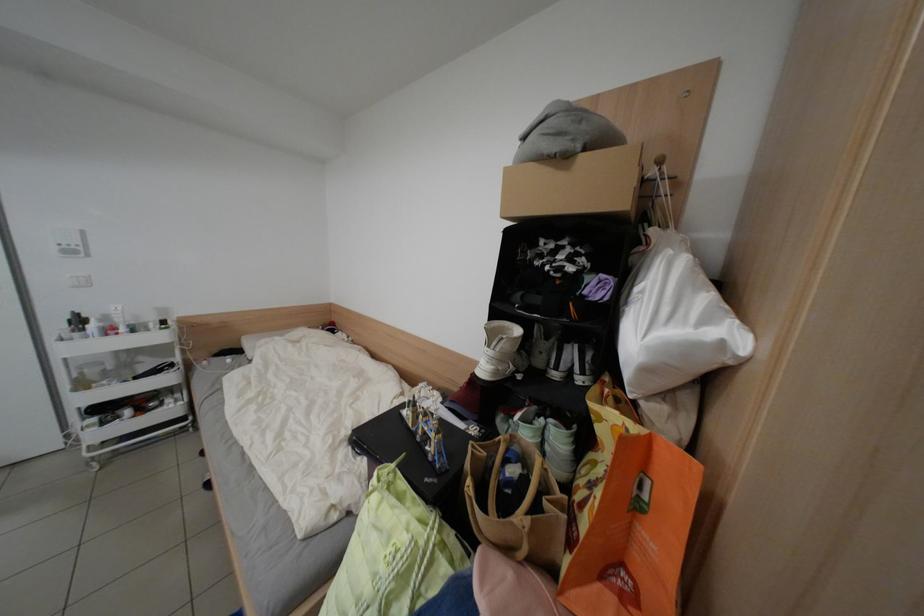
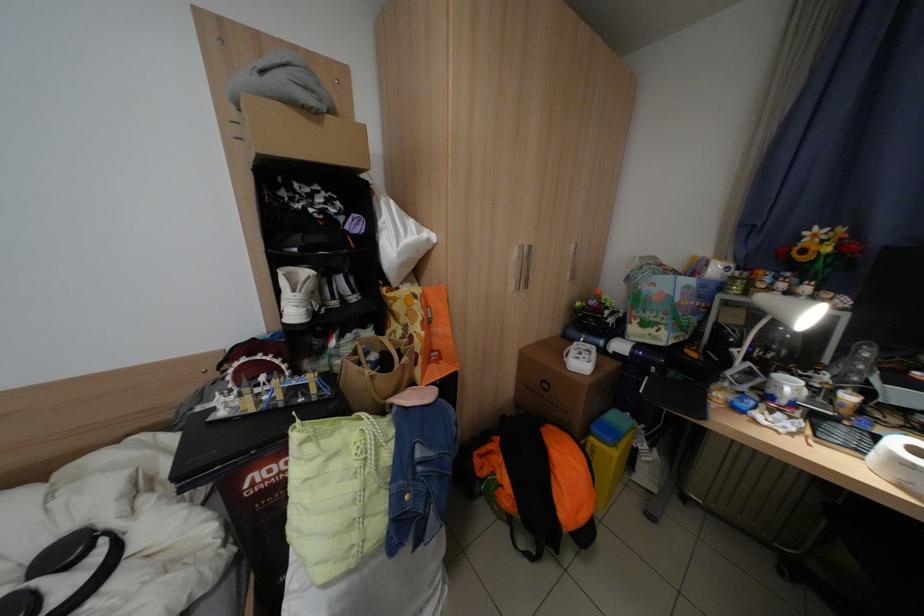
Locate, in the second image, the point that corresponds to point (508, 351) in the first image.

(314, 292)